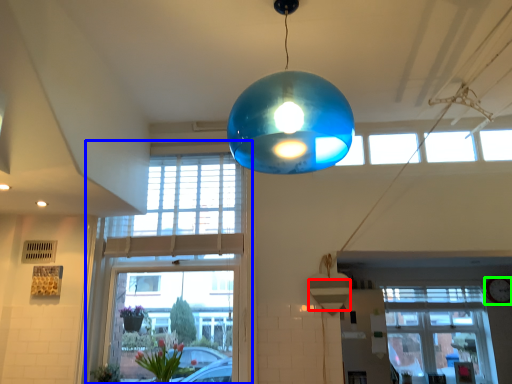
Question: Based on their relative distances, which object is farther from lampshade (highlighted by a red box)? Choose from window (highlighted by a blue box) and clock (highlighted by a green box).

Choices:
 (A) window
 (B) clock

Answer: (B)